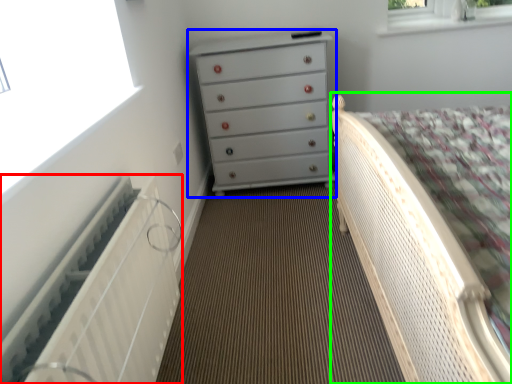
Question: Which object is positioned closest to radiator (highlighted by a red box)? Select from chest of drawers (highlighted by a blue box) and bed (highlighted by a green box).

Choices:
 (A) chest of drawers
 (B) bed

Answer: (B)